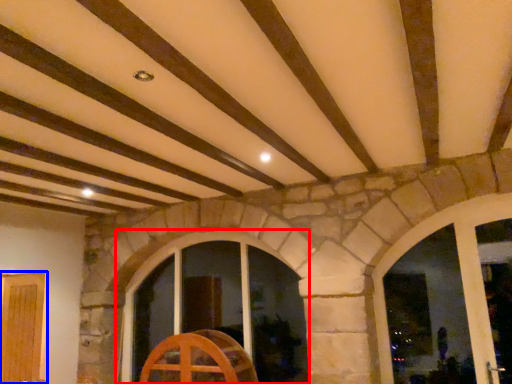
Question: Which object is further to the camera taking this photo, window (highlighted by a red box) or door (highlighted by a blue box)?

Choices:
 (A) window
 (B) door

Answer: (A)